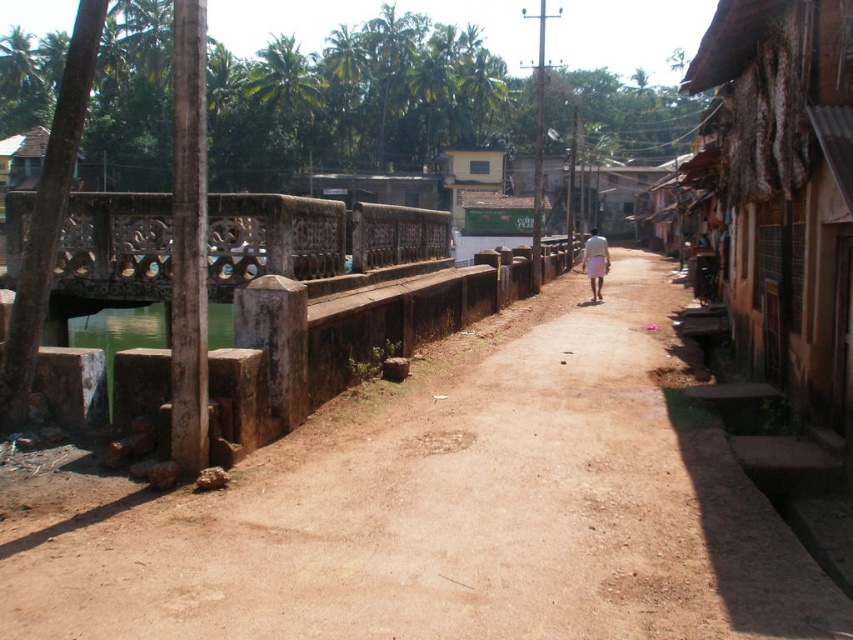
You are standing at the point marked as point (448, 513) in the image. What is the surface you are standing on?

The point (448, 513) is on brown dirt path at center, so you are standing on a brown dirt path.